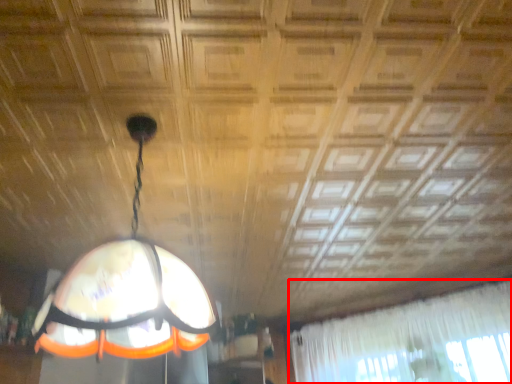
Question: Where is curtain (annotated by the red box) located in relation to lamp in the image?

Choices:
 (A) left
 (B) right

Answer: (B)